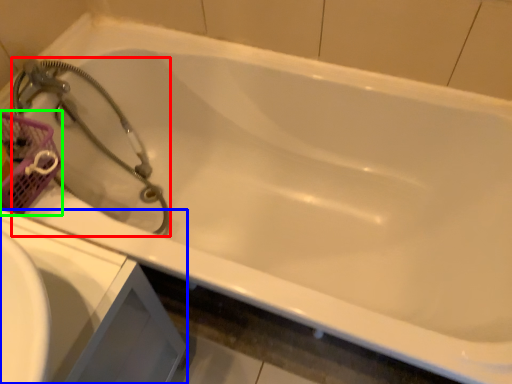
Question: Which is nearer to the garden hose (highlighted by a red box)? sink (highlighted by a blue box) or basket (highlighted by a green box).

Choices:
 (A) sink
 (B) basket

Answer: (B)